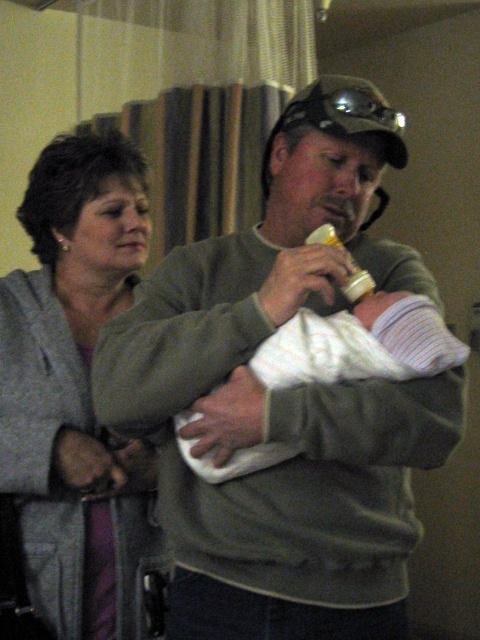
Question: Which point is farther to the camera?

Choices:
 (A) white soft cloth at center
 (B) gray fleece jacket at upper left
 (C) green matte sweater at center

Answer: (B)

Question: Is green matte sweater at center positioned in front of gray fleece jacket at upper left?

Choices:
 (A) no
 (B) yes

Answer: (B)

Question: Which of the following is the closest to the observer?

Choices:
 (A) (403, 328)
 (B) (88, 387)
 (C) (272, 564)

Answer: (A)

Question: Which point is farther from the camera taking this photo?

Choices:
 (A) (97, 573)
 (B) (317, 541)
 (C) (242, 458)

Answer: (A)

Question: Does green matte sweater at center have a smaller size compared to white soft cloth at center?

Choices:
 (A) no
 (B) yes

Answer: (A)

Question: Is green matte sweater at center above gray fleece jacket at upper left?

Choices:
 (A) yes
 (B) no

Answer: (A)